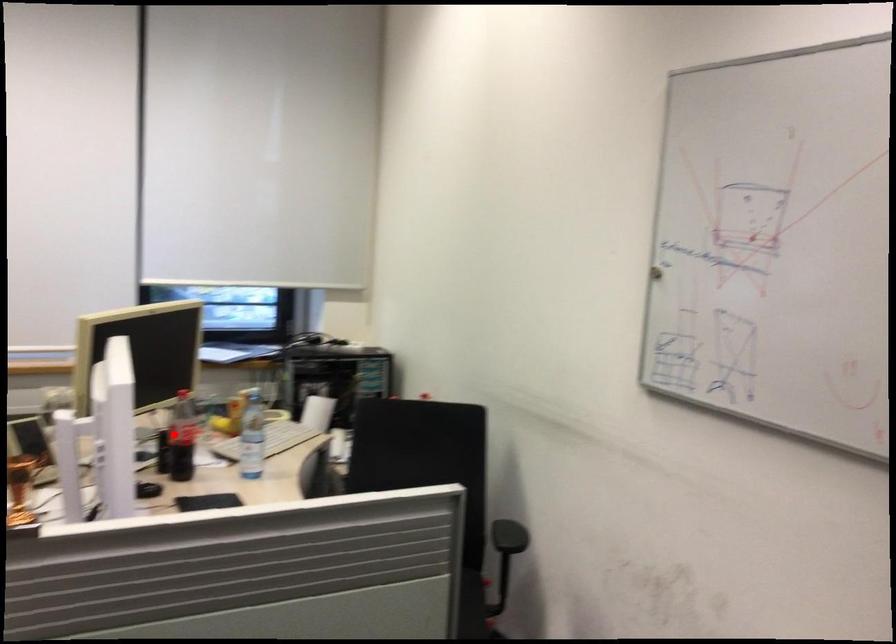
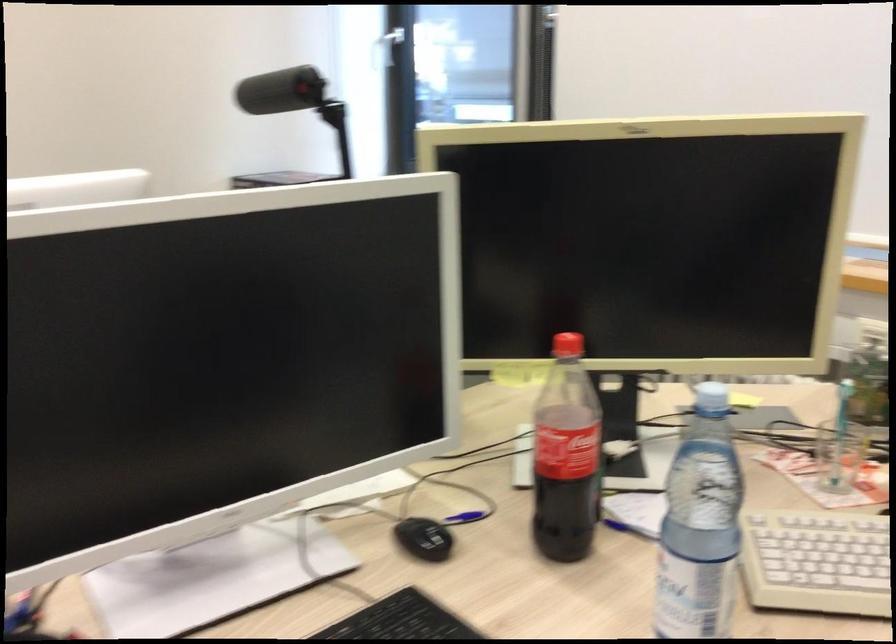
Locate, in the second image, the point that corresponds to the highlighted location in the first image.

(565, 456)